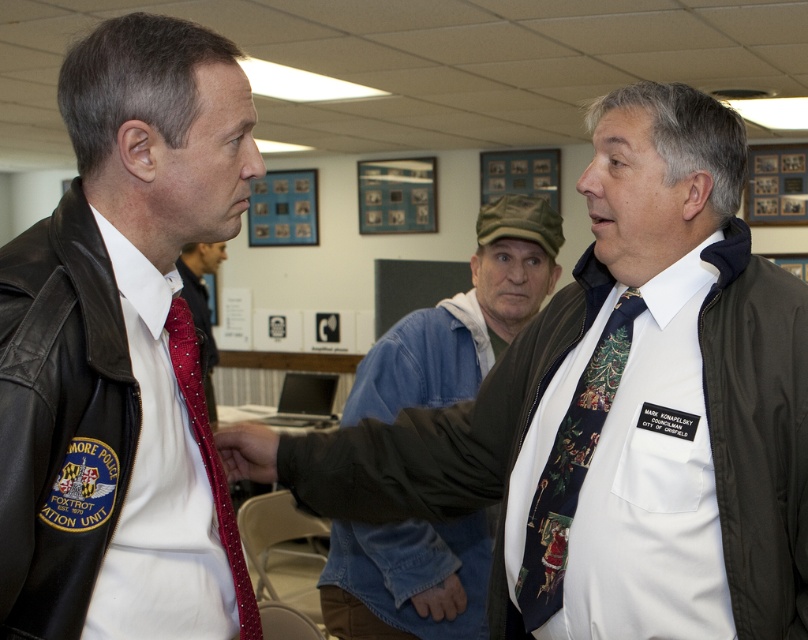
Which is above, dark blue textured tie at center or matte black hand at center?

matte black hand at center is above.

Measure the distance between dark blue textured tie at center and camera.

dark blue textured tie at center is 1.33 meters from camera.

Where is `dark blue textured tie at center`? dark blue textured tie at center is located at coordinates (570, 468).

Can you confirm if dark green leather jacket at center is positioned below denim jacket at center?

Yes.

Can you confirm if dark green leather jacket at center is positioned above denim jacket at center?

Incorrect, dark green leather jacket at center is not positioned above denim jacket at center.

Does point (558, 308) lie behind point (478, 230)?

No, (558, 308) is closer to viewer.

Where is `dark green leather jacket at center`? dark green leather jacket at center is located at coordinates (760, 435).

Is leather jacket at left shorter than dark green leather jacket at center?

In fact, leather jacket at left may be taller than dark green leather jacket at center.

Which is above, leather jacket at left or dark green leather jacket at center?

leather jacket at left is above.

Does point (116, 417) come behind point (785, 368)?

No, (116, 417) is in front of (785, 368).

Where is `leather jacket at left`? leather jacket at left is located at coordinates (123, 352).